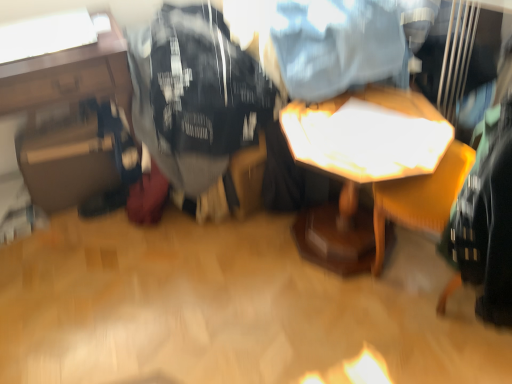
What do you see at coordinates (69, 74) in the screenshot? The height and width of the screenshot is (384, 512). I see `matte black suitcase at left, placed as the 2th table when sorted from right to left` at bounding box center [69, 74].

Identify the location of wooden table at center, the second table in the left-to-right sequence. The height and width of the screenshot is (384, 512). (368, 136).

Is matte black suitcase at left, placed as the 2th table when sorted from right to left, not close to wooden table at center, the second table in the left-to-right sequence?

Actually, matte black suitcase at left, placed as the 2th table when sorted from right to left, and wooden table at center, the second table in the left-to-right sequence, are a little close together.

Considering the relative positions of matte black suitcase at left, placed as the 2th table when sorted from right to left, and wooden table at center, the first table when ordered from right to left, in the image provided, is matte black suitcase at left, placed as the 2th table when sorted from right to left, to the right of wooden table at center, the first table when ordered from right to left, from the viewer's perspective?

In fact, matte black suitcase at left, placed as the 2th table when sorted from right to left, is to the left of wooden table at center, the first table when ordered from right to left.

Is matte black suitcase at left, placed as the 2th table when sorted from right to left, wider or thinner than wooden table at center, the first table when ordered from right to left?

In the image, matte black suitcase at left, placed as the 2th table when sorted from right to left, appears to be more narrow than wooden table at center, the first table when ordered from right to left.

The width and height of the screenshot is (512, 384). I want to click on table below the matte black suitcase at left, placed as the 2th table when sorted from right to left (from a real-world perspective), so click(368, 136).

Measure the distance between matte black suitcase at left, placed as the 2th table when sorted from right to left, and black cotton t-shirt at center.

matte black suitcase at left, placed as the 2th table when sorted from right to left, and black cotton t-shirt at center are 9.86 inches apart from each other.

From the image's perspective, which is below, matte black suitcase at left, placed as the 2th table when sorted from right to left, or black cotton t-shirt at center?

matte black suitcase at left, placed as the 2th table when sorted from right to left, is shown below in the image.

Does matte black suitcase at left, which is the 1th table in left-to-right order, have a greater height compared to black cotton t-shirt at center?

Indeed, matte black suitcase at left, which is the 1th table in left-to-right order, has a greater height compared to black cotton t-shirt at center.

Considering their positions, is matte black suitcase at left, placed as the 2th table when sorted from right to left, located in front of or behind black cotton t-shirt at center?

Clearly, matte black suitcase at left, placed as the 2th table when sorted from right to left, is behind black cotton t-shirt at center.

Considering the relative sizes of wooden table at center, the first table when ordered from right to left, and black cotton t-shirt at center in the image provided, is wooden table at center, the first table when ordered from right to left, wider than black cotton t-shirt at center?

No.

Is wooden table at center, the first table when ordered from right to left, shorter than black cotton t-shirt at center?

No.

Considering the positions of objects wooden table at center, the second table in the left-to-right sequence, and black cotton t-shirt at center in the image provided, who is more to the left, wooden table at center, the second table in the left-to-right sequence, or black cotton t-shirt at center?

black cotton t-shirt at center.

Considering the relative sizes of wooden table at center, the second table in the left-to-right sequence, and black cotton t-shirt at center in the image provided, is wooden table at center, the second table in the left-to-right sequence, smaller than black cotton t-shirt at center?

Yes.

Locate an element on the screen. Image resolution: width=512 pixels, height=384 pixels. clothing above the wooden table at center, the second table in the left-to-right sequence (from a real-world perspective) is located at coordinates (192, 103).

Between black cotton t-shirt at center and wooden table at center, the first table when ordered from right to left, which one has less height?

black cotton t-shirt at center is shorter.

From a real-world perspective, is black cotton t-shirt at center over wooden table at center, the first table when ordered from right to left?

Yes, from a real-world perspective, black cotton t-shirt at center is over wooden table at center, the first table when ordered from right to left

Is black cotton t-shirt at center far away from wooden table at center, the second table in the left-to-right sequence?

No, black cotton t-shirt at center is not far away from wooden table at center, the second table in the left-to-right sequence.

Is wooden table at center, the first table when ordered from right to left, to the left of matte black suitcase at left, which is the 1th table in left-to-right order, from the viewer's perspective?

In fact, wooden table at center, the first table when ordered from right to left, is to the right of matte black suitcase at left, which is the 1th table in left-to-right order.

Is the position of wooden table at center, the second table in the left-to-right sequence, more distant than that of matte black suitcase at left, which is the 1th table in left-to-right order?

No.

From a real-world perspective, which is physically below, wooden table at center, the first table when ordered from right to left, or matte black suitcase at left, which is the 1th table in left-to-right order?

wooden table at center, the first table when ordered from right to left, is physically lower.

Does wooden table at center, the first table when ordered from right to left, touch matte black suitcase at left, placed as the 2th table when sorted from right to left?

No, wooden table at center, the first table when ordered from right to left, is not with matte black suitcase at left, placed as the 2th table when sorted from right to left.

From a real-world perspective, is black cotton t-shirt at center physically located above or below matte black suitcase at left, which is the 1th table in left-to-right order?

Clearly, from a real-world perspective, black cotton t-shirt at center is above matte black suitcase at left, which is the 1th table in left-to-right order.

Does black cotton t-shirt at center appear on the right side of matte black suitcase at left, which is the 1th table in left-to-right order?

Yes, black cotton t-shirt at center is to the right of matte black suitcase at left, which is the 1th table in left-to-right order.

Can you confirm if black cotton t-shirt at center is shorter than matte black suitcase at left, which is the 1th table in left-to-right order?

Correct, black cotton t-shirt at center is not as tall as matte black suitcase at left, which is the 1th table in left-to-right order.

How many degrees apart are the facing directions of black cotton t-shirt at center and matte black suitcase at left, which is the 1th table in left-to-right order?

Answer: The angular difference between black cotton t-shirt at center and matte black suitcase at left, which is the 1th table in left-to-right order, is 12.9 degrees.

At what (x,y) coordinates should I click in order to perform the action: click on table located above the wooden table at center, the first table when ordered from right to left (from the image's perspective). Please return your answer as a coordinate pair (x, y). Looking at the image, I should click on (69, 74).

The height and width of the screenshot is (384, 512). I want to click on clothing that is above the matte black suitcase at left, which is the 1th table in left-to-right order (from a real-world perspective), so click(192, 103).

When comparing their distances from black cotton t-shirt at center, does wooden table at center, the second table in the left-to-right sequence, or matte black suitcase at left, placed as the 2th table when sorted from right to left, seem further?

wooden table at center, the second table in the left-to-right sequence.

When comparing their distances from wooden table at center, the second table in the left-to-right sequence, does black cotton t-shirt at center or matte black suitcase at left, which is the 1th table in left-to-right order, seem further?

Among the two, matte black suitcase at left, which is the 1th table in left-to-right order, is located further to wooden table at center, the second table in the left-to-right sequence.

Based on their spatial positions, is matte black suitcase at left, placed as the 2th table when sorted from right to left, or wooden table at center, the first table when ordered from right to left, closer to black cotton t-shirt at center?

matte black suitcase at left, placed as the 2th table when sorted from right to left.

From the image, which object appears to be nearer to matte black suitcase at left, placed as the 2th table when sorted from right to left, black cotton t-shirt at center or wooden table at center, the second table in the left-to-right sequence?

black cotton t-shirt at center is positioned closer to the anchor matte black suitcase at left, placed as the 2th table when sorted from right to left.

When comparing their distances from wooden table at center, the first table when ordered from right to left, does matte black suitcase at left, which is the 1th table in left-to-right order, or black cotton t-shirt at center seem further?

matte black suitcase at left, which is the 1th table in left-to-right order.

Based on their spatial positions, is wooden table at center, the first table when ordered from right to left, or black cotton t-shirt at center closer to matte black suitcase at left, which is the 1th table in left-to-right order?

Based on the image, black cotton t-shirt at center appears to be nearer to matte black suitcase at left, which is the 1th table in left-to-right order.

Where is `clothing situated between matte black suitcase at left, which is the 1th table in left-to-right order, and wooden table at center, the second table in the left-to-right sequence, from left to right`? Image resolution: width=512 pixels, height=384 pixels. clothing situated between matte black suitcase at left, which is the 1th table in left-to-right order, and wooden table at center, the second table in the left-to-right sequence, from left to right is located at coordinates (192, 103).